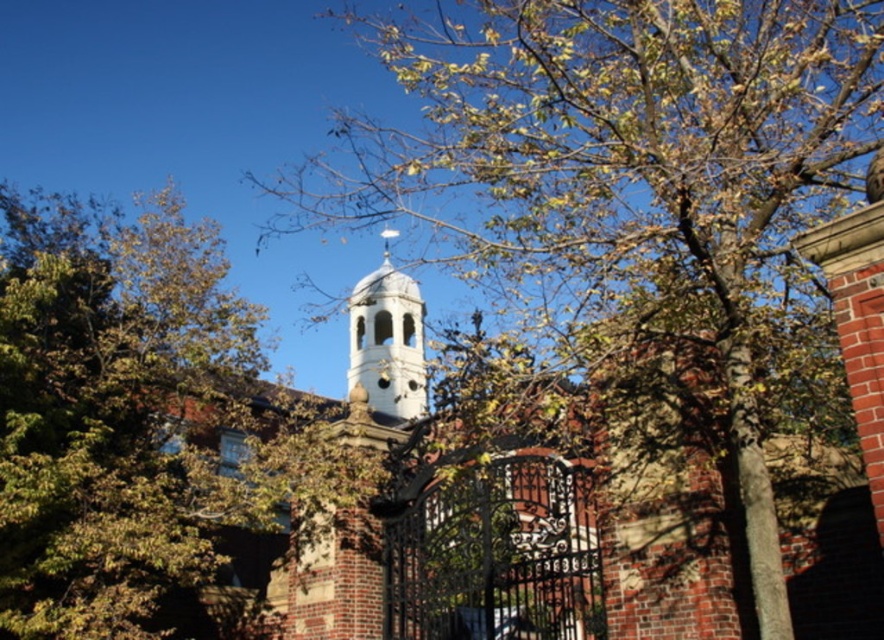
Is green leafy tree at upper center wider than white stone bell tower at center?

Yes.

Between green leafy tree at upper center and white stone bell tower at center, which one has more height?

With more height is green leafy tree at upper center.

In the scene shown: Measure the distance between point (120, 483) and camera.

Point (120, 483) and camera are 38.65 meters apart from each other.

Locate an element on the screen. green leafy tree at upper center is located at coordinates (149, 429).

Can you confirm if brown leafy tree at center is positioned to the left of green leafy tree at upper center?

In fact, brown leafy tree at center is to the right of green leafy tree at upper center.

Does point (637, 99) come behind point (237, 483)?

No, it is in front of (237, 483).

Locate an element on the screen. This screenshot has width=884, height=640. brown leafy tree at center is located at coordinates (638, 192).

Can you confirm if brown leafy tree at center is taller than white stone bell tower at center?

Indeed, brown leafy tree at center has a greater height compared to white stone bell tower at center.

What do you see at coordinates (638, 192) in the screenshot? I see `brown leafy tree at center` at bounding box center [638, 192].

Image resolution: width=884 pixels, height=640 pixels. I want to click on brown leafy tree at center, so click(x=638, y=192).

Locate an element on the screen. The image size is (884, 640). brown leafy tree at center is located at coordinates (638, 192).